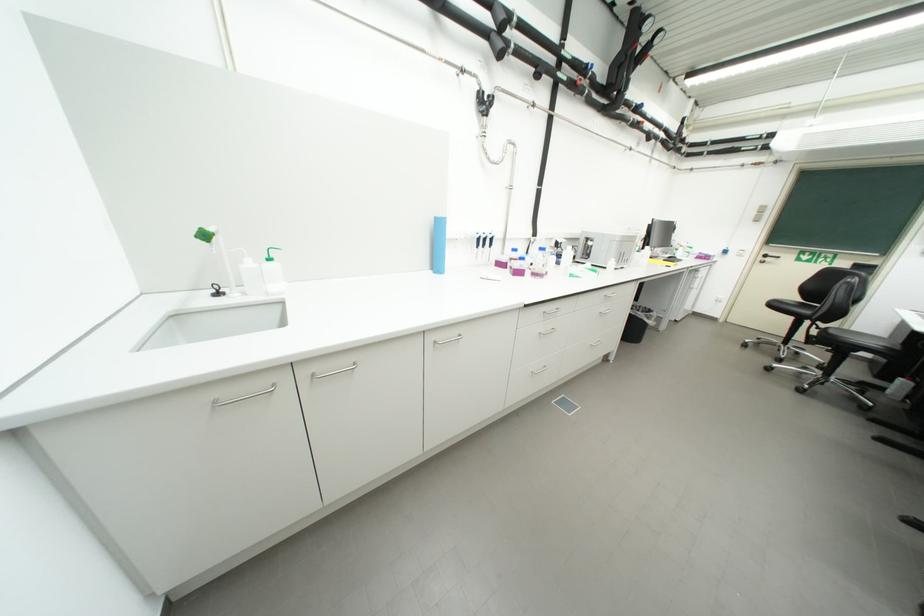
Identify the location of green pump dispenser. This screenshot has width=924, height=616. (271, 254).